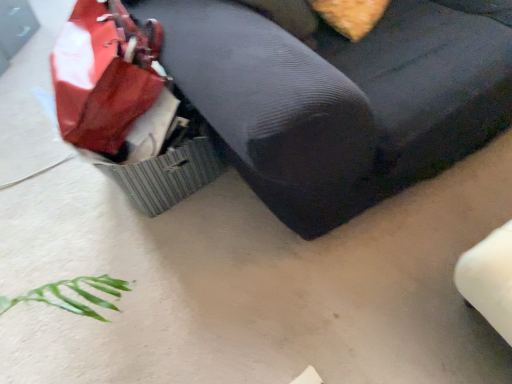
Find the location of a particular element. textured fabric ottoman at center is located at coordinates (340, 96).

This screenshot has width=512, height=384. What do you see at coordinates (340, 96) in the screenshot? I see `textured fabric ottoman at center` at bounding box center [340, 96].

This screenshot has width=512, height=384. Identify the location of textured fabric ottoman at center. (340, 96).